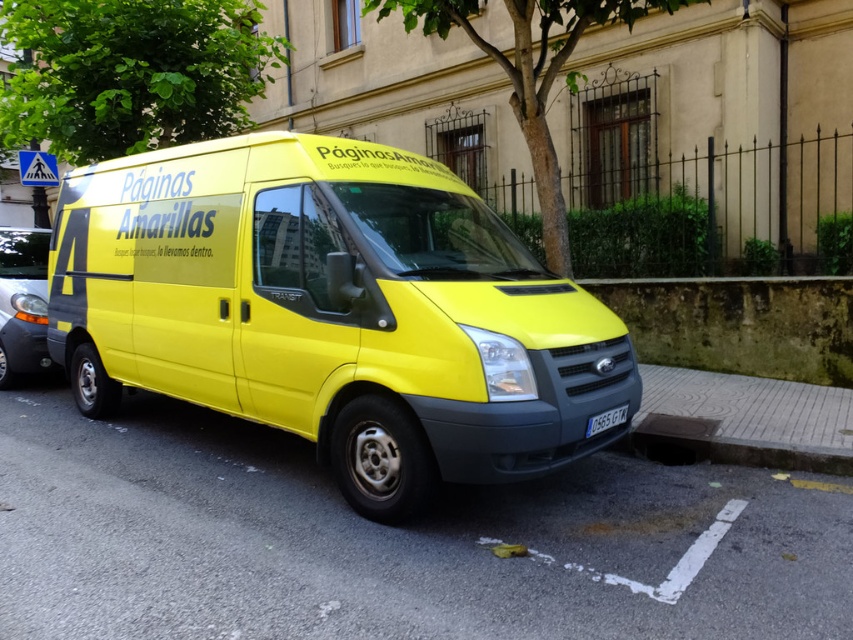
Which is more to the right, metallic gray car at left or yellow matte license plate at center?

Positioned to the right is yellow matte license plate at center.

This screenshot has height=640, width=853. Describe the element at coordinates (22, 301) in the screenshot. I see `metallic gray car at left` at that location.

Locate an element on the screen. Image resolution: width=853 pixels, height=640 pixels. metallic gray car at left is located at coordinates [22, 301].

Can you confirm if yellow matte van at center is thinner than metallic gray car at left?

No, yellow matte van at center is not thinner than metallic gray car at left.

Locate an element on the screen. This screenshot has height=640, width=853. yellow matte van at center is located at coordinates (332, 310).

Where is `yellow matte van at center`? Image resolution: width=853 pixels, height=640 pixels. yellow matte van at center is located at coordinates (332, 310).

Is point (143, 218) farther from viewer compared to point (602, 429)?

Yes, it is.

Looking at this image, who is taller, yellow matte van at center or yellow matte license plate at center?

yellow matte van at center is taller.

Between point (165, 177) and point (596, 416), which one is positioned behind?

The point (165, 177) is behind.

At what (x,y) coordinates should I click in order to perform the action: click on yellow matte van at center. Please return your answer as a coordinate pair (x, y). The height and width of the screenshot is (640, 853). Looking at the image, I should click on 332,310.